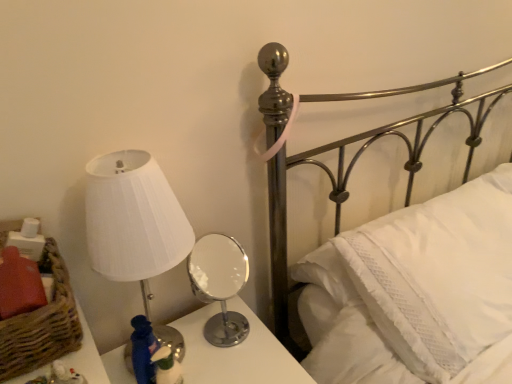
Question: Relative to brown woven basket at lower left, is polished chrome mirror at center in front or behind?

Choices:
 (A) front
 (B) behind

Answer: (B)

Question: From the image's perspective, is polished chrome mirror at center located above or below brown woven basket at lower left?

Choices:
 (A) above
 (B) below

Answer: (B)

Question: Which object is positioned closest to the brown woven basket at lower left?

Choices:
 (A) polished chrome mirror at center
 (B) metallic silver table lamp at center
 (C) white textured pillow at upper right
 (D) white pleated fabric lampshade at left
 (E) metallic silver bed at upper right

Answer: (D)

Question: Based on their relative distances, which object is nearer to the polished chrome mirror at center?

Choices:
 (A) metallic silver table lamp at center
 (B) brown woven basket at lower left
 (C) white textured pillow at upper right
 (D) metallic silver bed at upper right
 (E) white pleated fabric lampshade at left

Answer: (E)